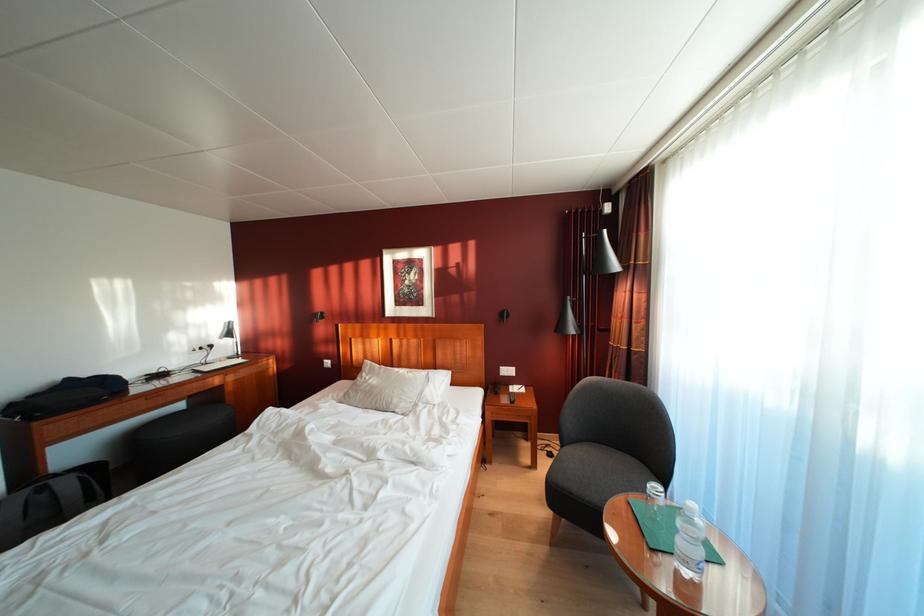
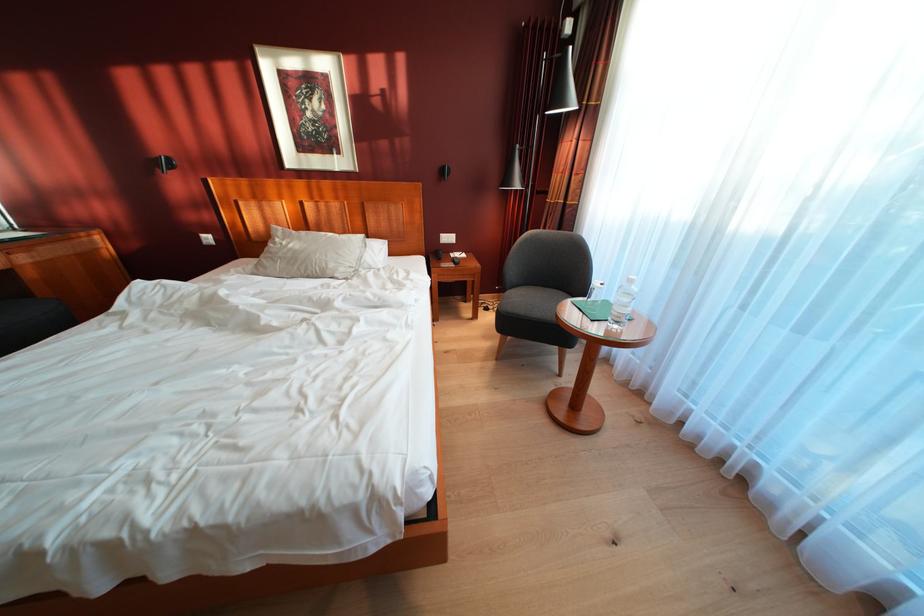
Question: What movement of the cameraman would produce the second image?

Choices:
 (A) Left
 (B) Right
 (C) Forward
 (D) Backward

Answer: (A)